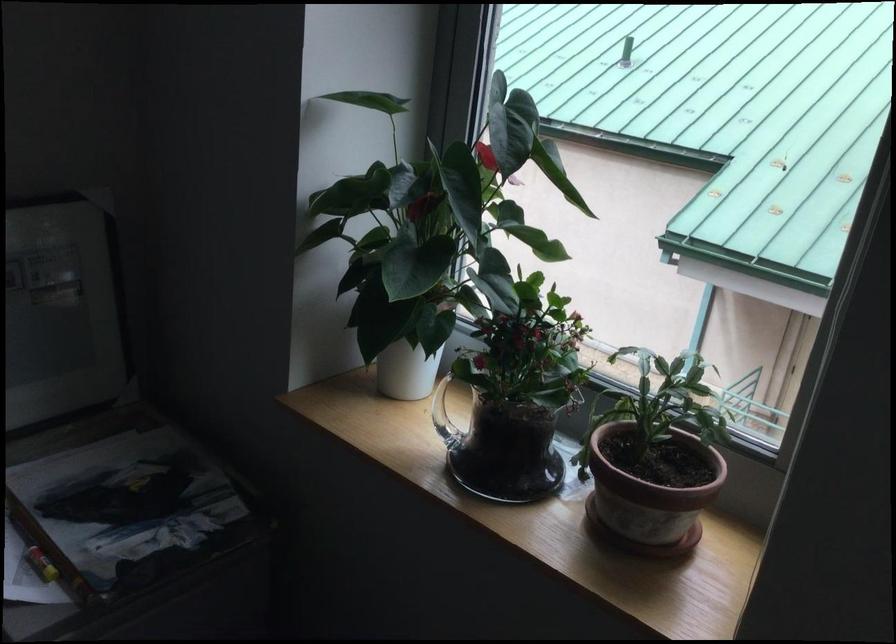
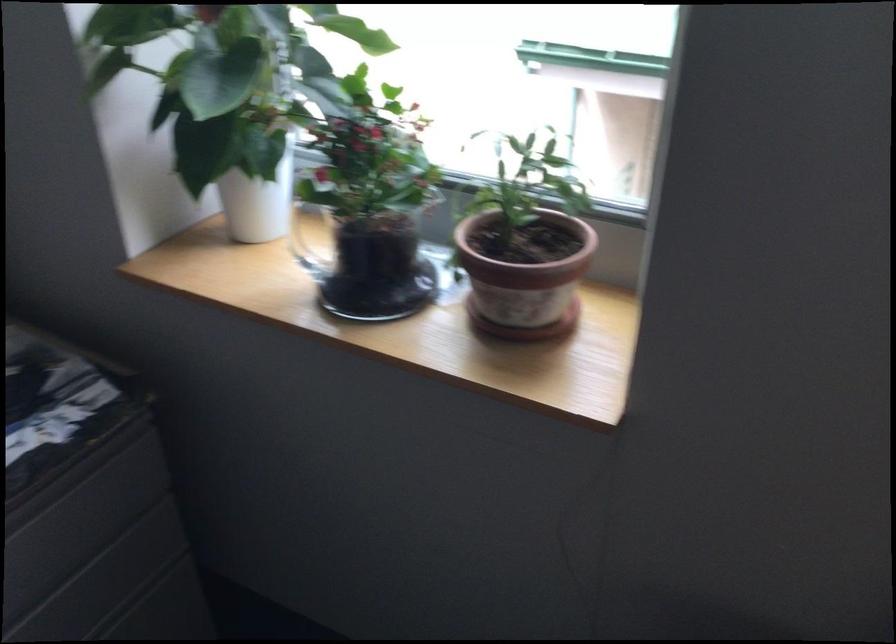
The images are taken continuously from a first-person perspective. In which direction are you moving?

The cameraman moved toward right, forward.